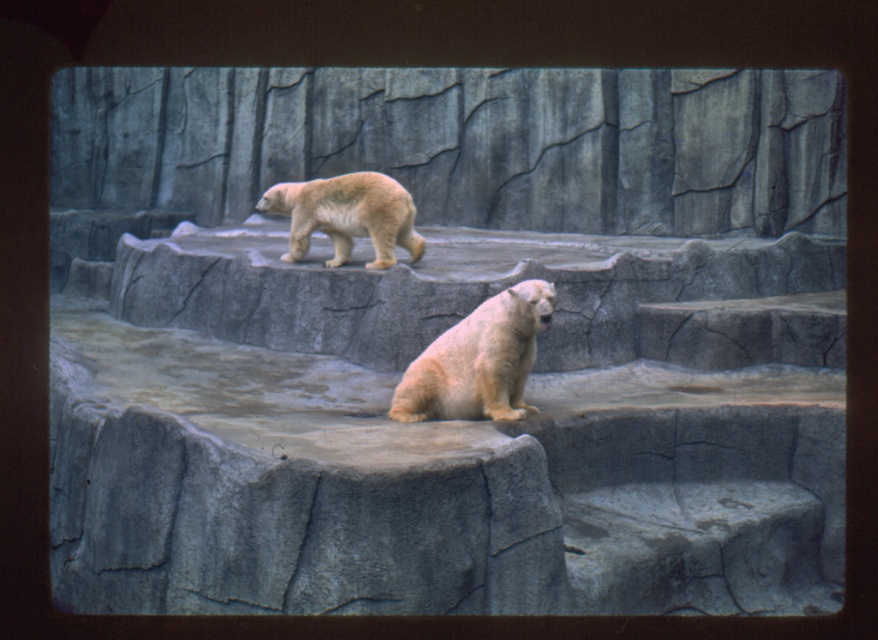
You are a zookeeper observing the polar bears in their enclosure. You notice two bears in the scene. Which bear is closer to you, the white fur bear at center or the light beige fur at upper center?

The white fur bear at center is closer to you because it is in front of the light beige fur at upper center.

You are a zookeeper observing the polar bears in their enclosure. You notice two bears with different fur colors. Which bear has a thinner body? The white fur bear at center or the light beige fur at upper center?

The white fur bear at center is thinner than the light beige fur at upper center.

You are a zookeeper observing the polar bears in their enclosure. You notice two bears with different fur colors. Which bear is taller, the white fur bear at center or the light beige fur at upper center?

The white fur bear at center is much taller than the light beige fur at upper center.